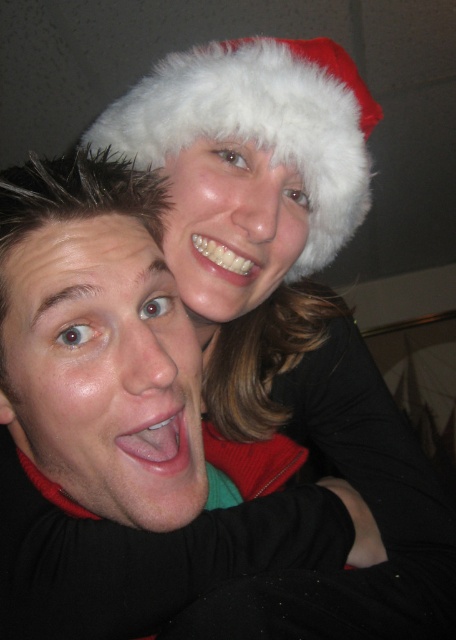
You are a photographer trying to capture a clear shot of both the matte black shirt at center and the white fluffy santa hat at upper center. Based on their sizes, which object should you focus on first to ensure it is in sharp focus?

The matte black shirt at center is larger in size than the white fluffy santa hat at upper center, so you should focus on the matte black shirt at center first to ensure it is in sharp focus since larger objects often require more precise focusing to capture details clearly.

You are trying to decide which item to grab first from the center of the image to give to a friend. The items are the matte black shirt at center and the white fluffy santa hat at upper center. According to their positions, which one is more to the left?

The matte black shirt at center is positioned on the left side of white fluffy santa hat at upper center, so the matte black shirt at center is more to the left.